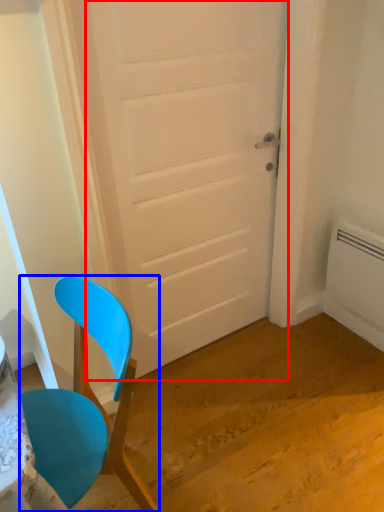
Question: Which point is further to the camera, door (highlighted by a red box) or chair (highlighted by a blue box)?

Choices:
 (A) door
 (B) chair

Answer: (A)